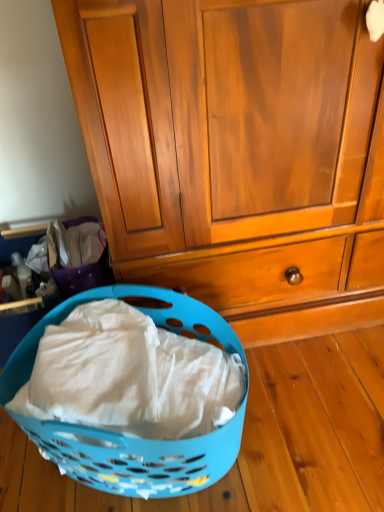
Question: Is point (142, 495) closer or farther from the camera than point (168, 74)?

Choices:
 (A) closer
 (B) farther

Answer: (B)

Question: In terms of width, does blue plastic laundry basket at lower left look wider or thinner when compared to wooden cabinet at center?

Choices:
 (A) wide
 (B) thin

Answer: (B)

Question: In the image, is blue plastic laundry basket at lower left positioned in front of or behind wooden cabinet at center?

Choices:
 (A) front
 (B) behind

Answer: (A)

Question: In terms of size, does wooden cabinet at center appear bigger or smaller than blue plastic laundry basket at lower left?

Choices:
 (A) small
 (B) big

Answer: (B)

Question: Visually, is wooden cabinet at center positioned to the left or to the right of blue plastic laundry basket at lower left?

Choices:
 (A) left
 (B) right

Answer: (B)

Question: Is point (155, 11) closer or farther from the camera than point (52, 425)?

Choices:
 (A) farther
 (B) closer

Answer: (B)

Question: Looking at their shapes, would you say wooden cabinet at center is wider or thinner than blue plastic laundry basket at lower left?

Choices:
 (A) wide
 (B) thin

Answer: (A)